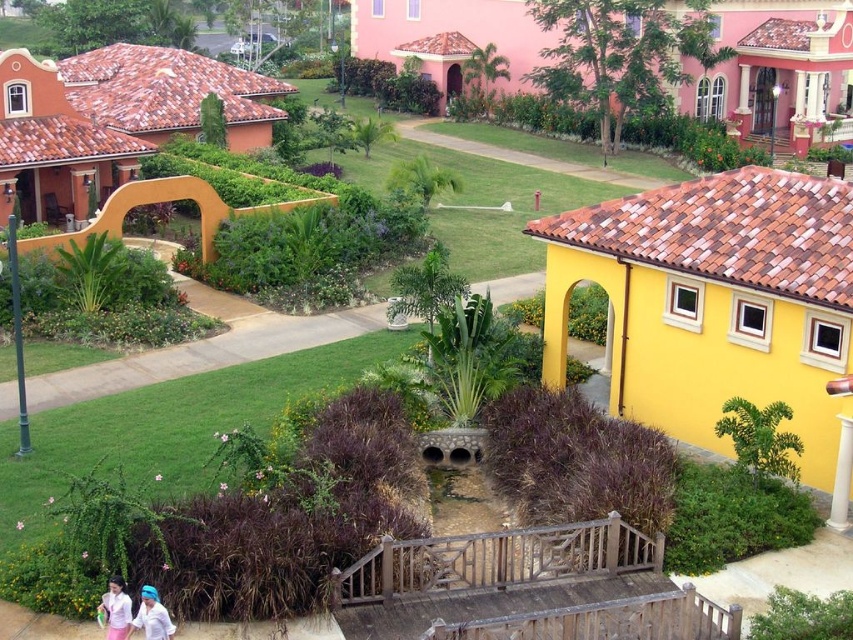
Does pink fabric dress at lower left have a smaller size compared to white matte shirt at lower left?

No, pink fabric dress at lower left is not smaller than white matte shirt at lower left.

Is pink fabric dress at lower left to the right of white matte shirt at lower left from the viewer's perspective?

Incorrect, pink fabric dress at lower left is not on the right side of white matte shirt at lower left.

Who is more forward, (97, 609) or (137, 612)?

Point (137, 612) is in front.

Locate an element on the screen. pink fabric dress at lower left is located at coordinates (115, 609).